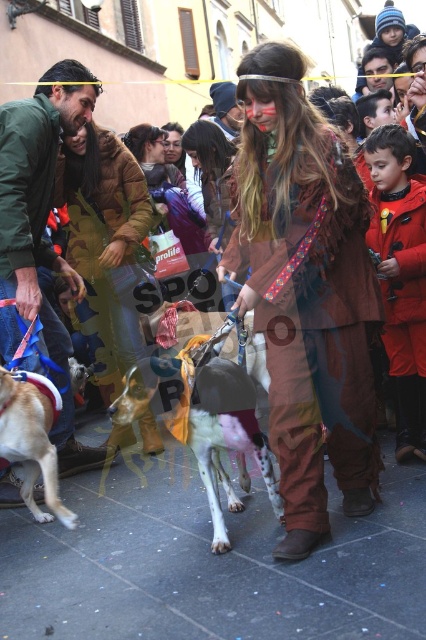
Is red fleece jacket at right to the right of smooth brown leather jacket at upper center from the viewer's perspective?

No, red fleece jacket at right is not to the right of smooth brown leather jacket at upper center.

Which is above, red fleece jacket at right or smooth brown leather jacket at upper center?

smooth brown leather jacket at upper center

Which is behind, point (365, 236) or point (371, 77)?

The point (371, 77) is more distant.

What are the coordinates of `red fleece jacket at right` in the screenshot? It's located at (400, 275).

Does brown suede vest at center have a lesser width compared to white fur dog at center?

No, brown suede vest at center is not thinner than white fur dog at center.

Between point (293, 273) and point (252, 408), which one is positioned in front?

Point (293, 273) is in front.

At what (x,y) coordinates should I click in order to perform the action: click on brown suede vest at center. Please return your answer as a coordinate pair (x, y). Image resolution: width=426 pixels, height=640 pixels. Looking at the image, I should click on (314, 326).

Is point (126, 266) positioned before point (54, 513)?

No.

Does point (81, 150) come behind point (43, 467)?

Yes, point (81, 150) is behind point (43, 467).

Who is more forward, (115, 218) or (28, 388)?

Point (28, 388) is more forward.

Where is `camouflage fabric jacket at center`? The height and width of the screenshot is (640, 426). camouflage fabric jacket at center is located at coordinates (104, 244).